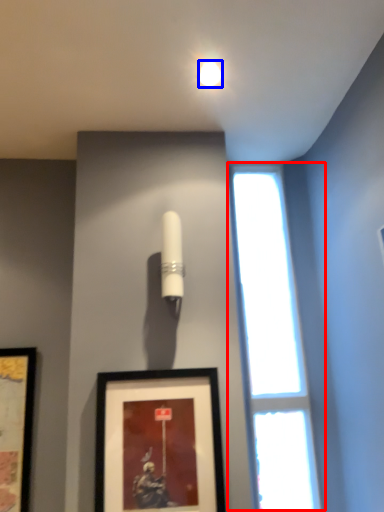
Question: Which object appears closest to the camera in this image, window (highlighted by a red box) or lighting (highlighted by a blue box)?

Choices:
 (A) window
 (B) lighting

Answer: (B)